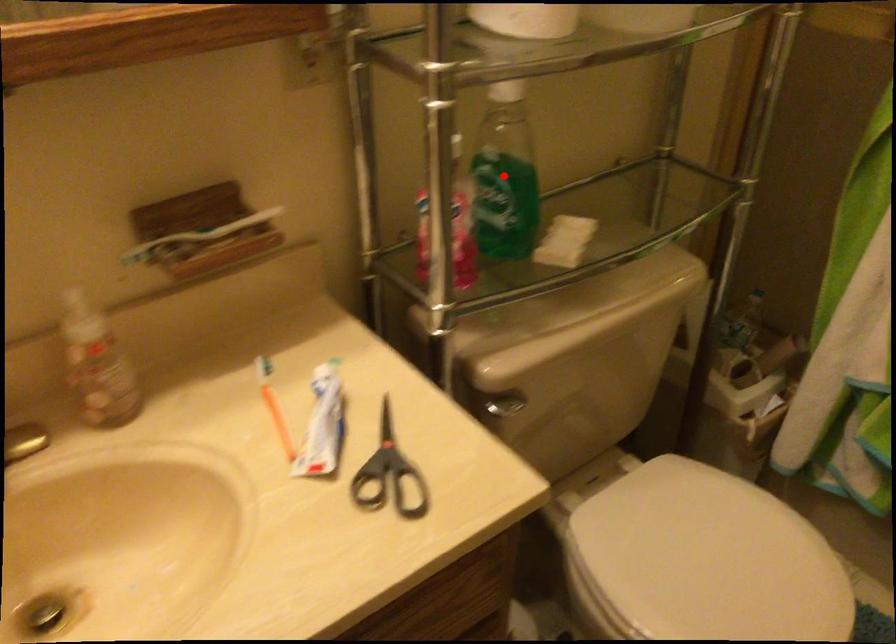
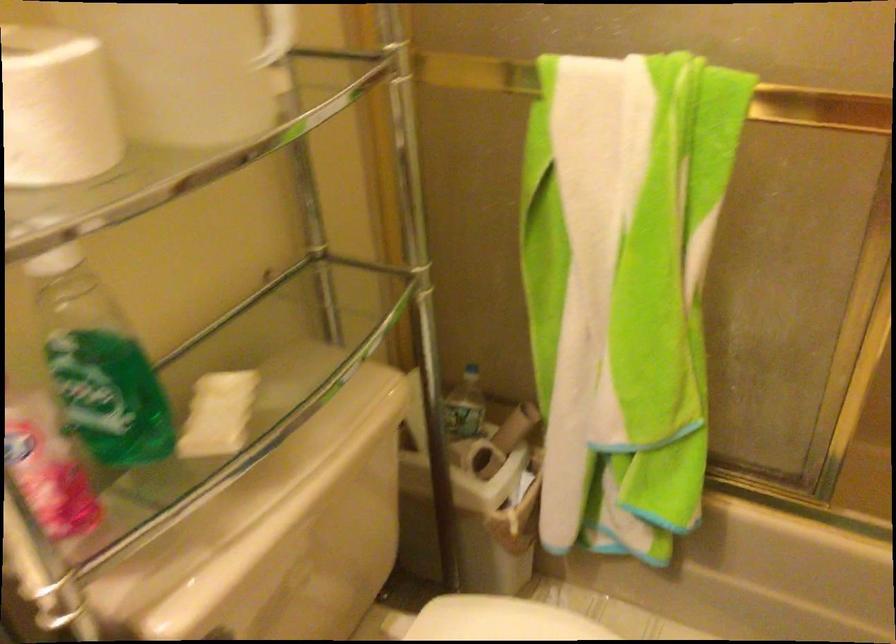
Question: I am providing you with two images of the same scene from different viewpoints. In image1, a red point is highlighted. Considering the same 3D point in image2, which of the following is correct?

Choices:
 (A) It is closer
 (B) It is farther

Answer: (A)